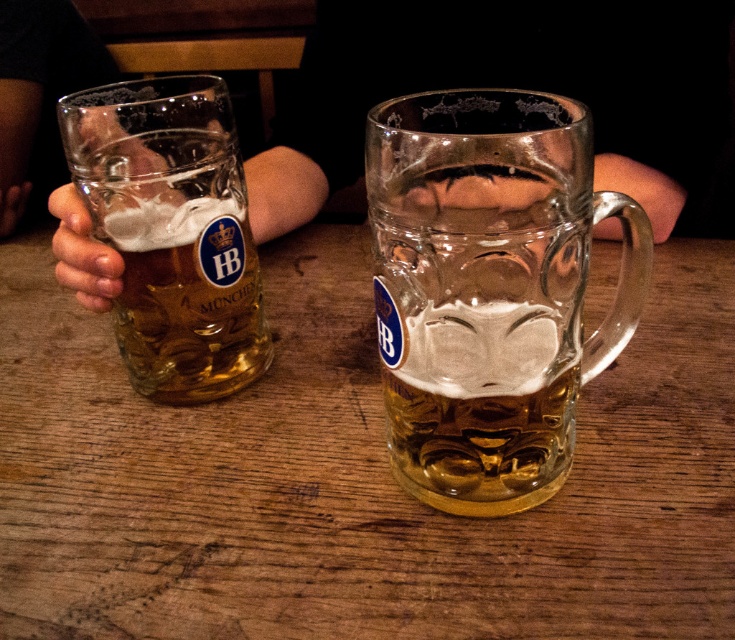
Which of these two, wooden table at center or smooth skin hand at left, stands shorter?

Standing shorter between the two is smooth skin hand at left.

Describe the element at coordinates (351, 477) in the screenshot. I see `wooden table at center` at that location.

This screenshot has width=735, height=640. I want to click on wooden table at center, so click(351, 477).

From the picture: Which of these two, wooden table at center or clear glass mug at center, stands shorter?

clear glass mug at center

Does point (60, 536) lie behind point (595, 356)?

No, (60, 536) is in front of (595, 356).

Find the location of a particular element. The width and height of the screenshot is (735, 640). wooden table at center is located at coordinates (351, 477).

Based on the photo, does wooden table at center have a larger size compared to translucent glass mug at left?

Indeed, wooden table at center has a larger size compared to translucent glass mug at left.

Between wooden table at center and translucent glass mug at left, which one appears on the right side from the viewer's perspective?

wooden table at center is more to the right.

The height and width of the screenshot is (640, 735). Find the location of `wooden table at center`. wooden table at center is located at coordinates (351, 477).